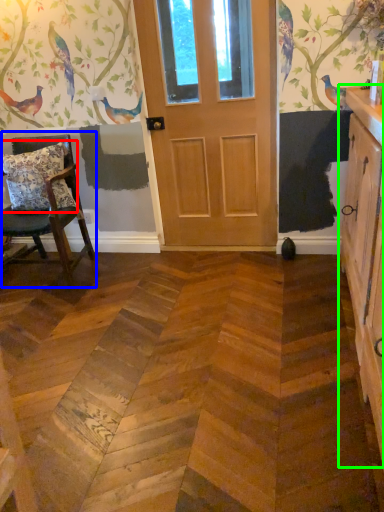
Question: Which object is positioned closest to pillow (highlighted by a red box)? Select from chair (highlighted by a blue box) and cabinetry (highlighted by a green box).

Choices:
 (A) chair
 (B) cabinetry

Answer: (A)